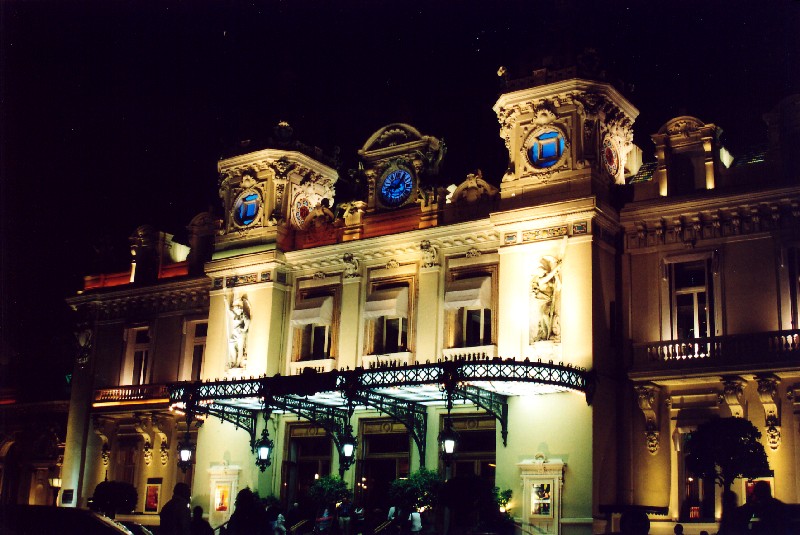
The width and height of the screenshot is (800, 535). What are the coordinates of `blue clock face` in the screenshot? It's located at (398, 192).